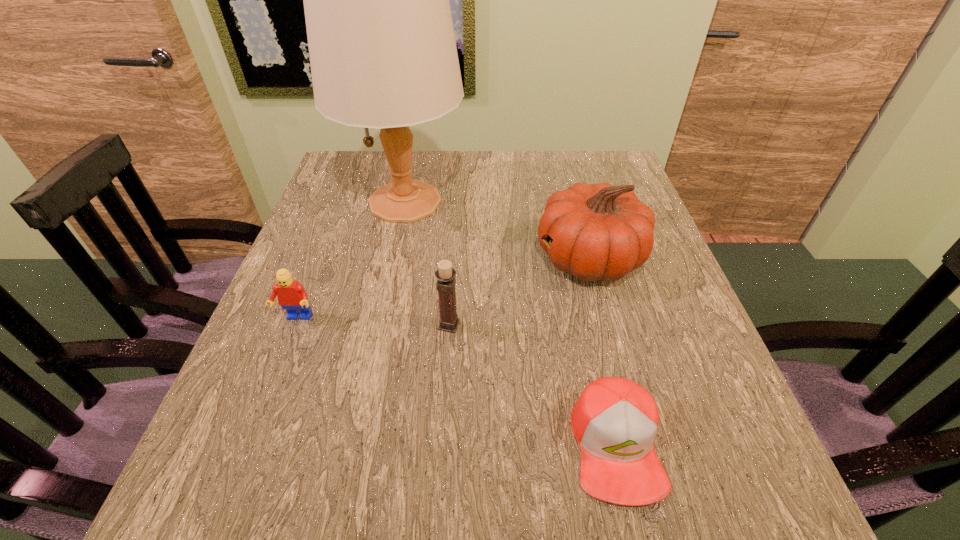
Where is `free space at the far edge of the desktop`? Image resolution: width=960 pixels, height=540 pixels. free space at the far edge of the desktop is located at coordinates (527, 163).

At what (x,y) coordinates should I click in order to perform the action: click on vacant space at the near edge of the desktop. Please return your answer as a coordinate pair (x, y). Looking at the image, I should click on (394, 530).

The height and width of the screenshot is (540, 960). In the image, there is a desktop. In order to click on vacant space at the left edge in this screenshot , I will do `click(301, 358)`.

Locate an element on the screen. free space at the right edge is located at coordinates (627, 326).

Locate an element on the screen. The width and height of the screenshot is (960, 540). free space at the far left corner is located at coordinates [x=353, y=152].

I want to click on vacant region at the near left corner, so click(284, 522).

Find the location of a particular element. The image size is (960, 540). vacant area at the far right corner is located at coordinates (579, 174).

The width and height of the screenshot is (960, 540). What are the coordinates of `free spot between the pumpkin and the nearest object` in the screenshot? It's located at (603, 352).

Where is `free spot between the pumpkin and the third tallest object`? The height and width of the screenshot is (540, 960). free spot between the pumpkin and the third tallest object is located at coordinates (519, 292).

Locate an element on the screen. The image size is (960, 540). vacant area that lies between the nearest object and the fourth tallest object is located at coordinates (456, 382).